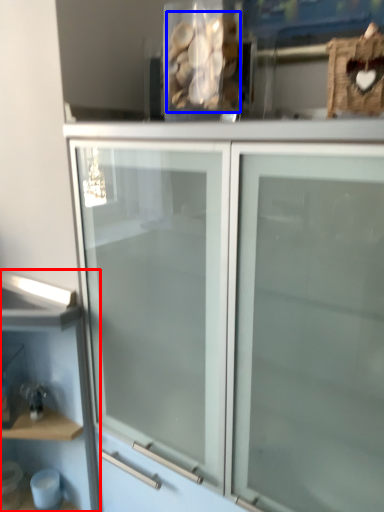
Question: Which of the following is the closest to the observer, shelf (highlighted by a red box) or stuff (highlighted by a blue box)?

Choices:
 (A) shelf
 (B) stuff

Answer: (B)